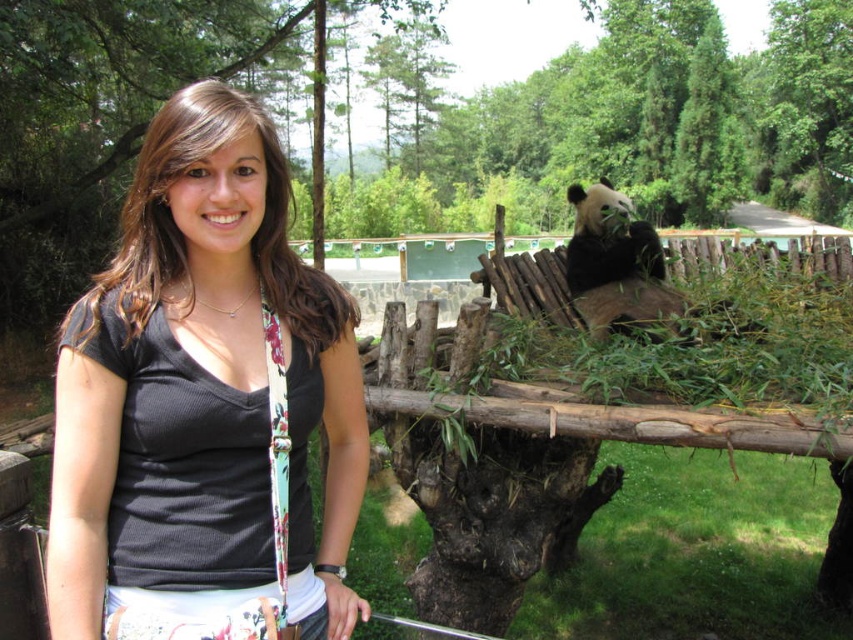
Is black fabric shirt at center below black fuzzy panda at upper right?

Correct, black fabric shirt at center is located below black fuzzy panda at upper right.

What do you see at coordinates (204, 404) in the screenshot?
I see `black fabric shirt at center` at bounding box center [204, 404].

Where is `black fabric shirt at center`? The height and width of the screenshot is (640, 853). black fabric shirt at center is located at coordinates (204, 404).